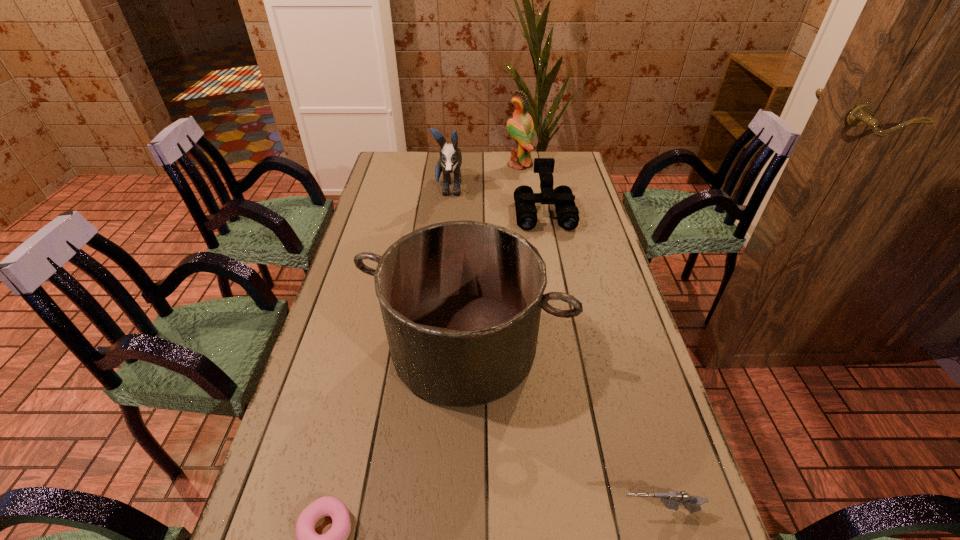
The image size is (960, 540). Find the location of `vacant space at the left edge of the desktop`. vacant space at the left edge of the desktop is located at coordinates (359, 346).

The image size is (960, 540). I want to click on free location at the right edge, so click(x=622, y=451).

In the image, there is a desktop. Where is `vacant space at the far left corner`? vacant space at the far left corner is located at coordinates (411, 178).

Image resolution: width=960 pixels, height=540 pixels. In order to click on vacant space in between the puppy and the binoculars in this screenshot , I will do `click(496, 201)`.

Where is `empty space between the third shortest object and the second shortest object`? empty space between the third shortest object and the second shortest object is located at coordinates (601, 362).

Select which object appears as the closest to the fourth farthest object. Please provide its 2D coordinates. Your answer should be formatted as a tuple, i.e. [(x, y)], where the tuple contains the x and y coordinates of a point satisfying the conditions above.

[(307, 539)]

Point out which object is positioned as the fourth nearest to the fourth tallest object. Please provide its 2D coordinates. Your answer should be formatted as a tuple, i.e. [(x, y)], where the tuple contains the x and y coordinates of a point satisfying the conditions above.

[(671, 500)]

The width and height of the screenshot is (960, 540). Identify the location of free space that satisfies the following two spatial constraints: 1. on the front-facing side of the farthest object; 2. on the front-facing side of the puppy. (522, 190).